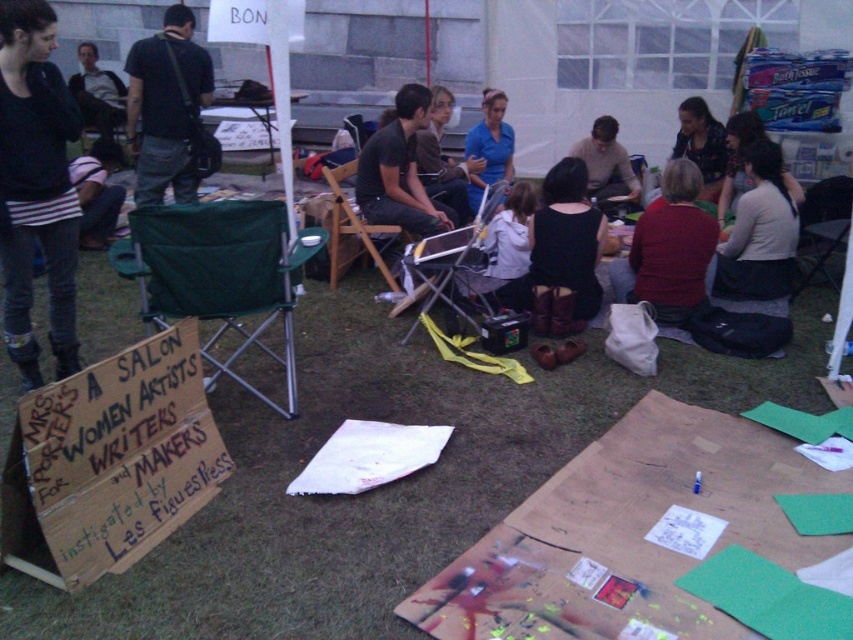
Between green fabric folding chair at lower left and matte black shirt at center, which one is positioned higher?

matte black shirt at center is above.

Is point (270, 234) positioned before point (442, 88)?

That is True.

Where is `green fabric folding chair at lower left`? The width and height of the screenshot is (853, 640). green fabric folding chair at lower left is located at coordinates (219, 275).

Can you confirm if black cotton shirt at left is smaller than pink striped shirt at lower left?

No.

Is point (135, 196) behind point (74, 164)?

No, (135, 196) is in front of (74, 164).

Is point (129, 141) behind point (96, 166)?

That is True.

In order to click on black cotton shirt at left in this screenshot , I will do `click(166, 106)`.

Can you confirm if black fabric dress at center is positioned to the right of matte black shirt at center?

Yes, black fabric dress at center is to the right of matte black shirt at center.

Does point (595, 250) come in front of point (434, 136)?

Yes, point (595, 250) is in front of point (434, 136).

The width and height of the screenshot is (853, 640). Find the location of `black fabric dress at center`. black fabric dress at center is located at coordinates (566, 252).